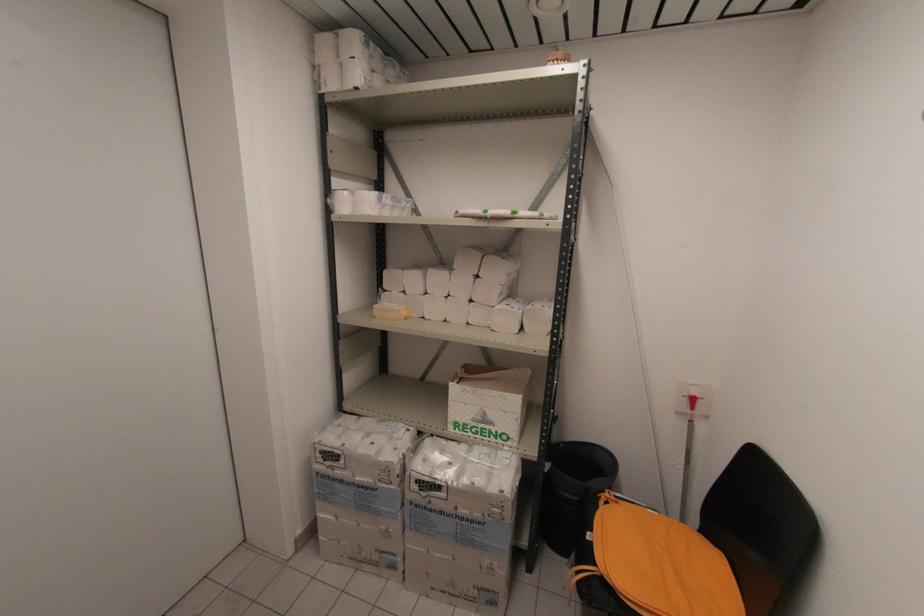
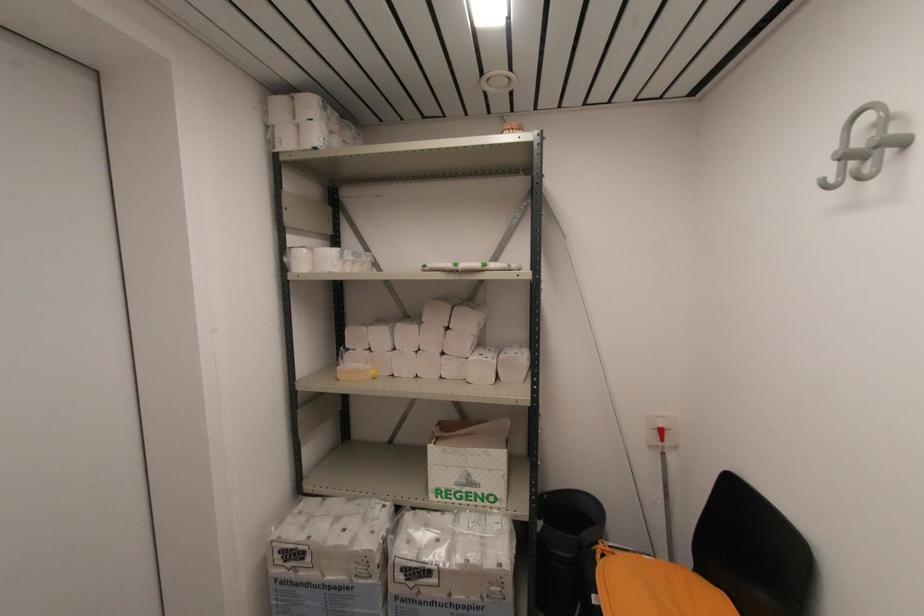
Where in the second image is the point corresponding to (694,408) from the first image?

(663, 439)